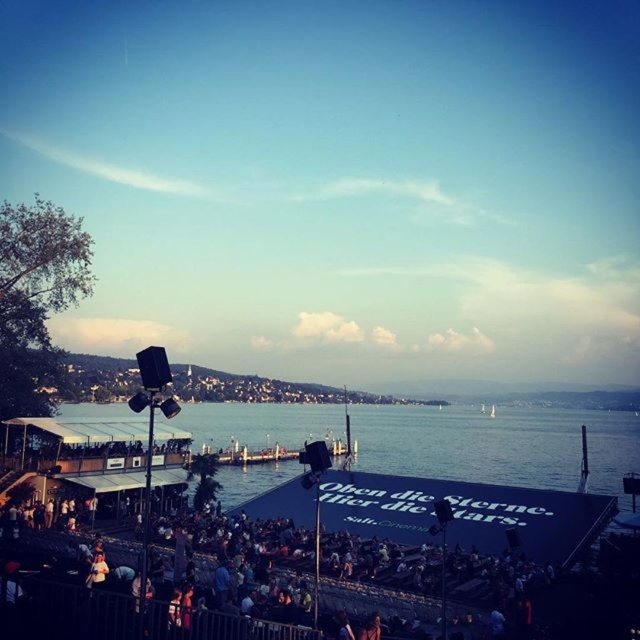
Is blue water at lower center taller than dark gray crowd at lower center?

Correct, blue water at lower center is much taller as dark gray crowd at lower center.

Does blue water at lower center have a smaller size compared to dark gray crowd at lower center?

No, blue water at lower center is not smaller than dark gray crowd at lower center.

The image size is (640, 640). What do you see at coordinates (483, 476) in the screenshot? I see `blue water at lower center` at bounding box center [483, 476].

You are a GUI agent. You are given a task and a screenshot of the screen. Output one action in this format:
    pyautogui.click(x=<x>, y=<y>)
    Task: Click on the blue water at lower center
    This screenshot has height=640, width=640.
    Given the screenshot: What is the action you would take?
    pyautogui.click(x=483, y=476)